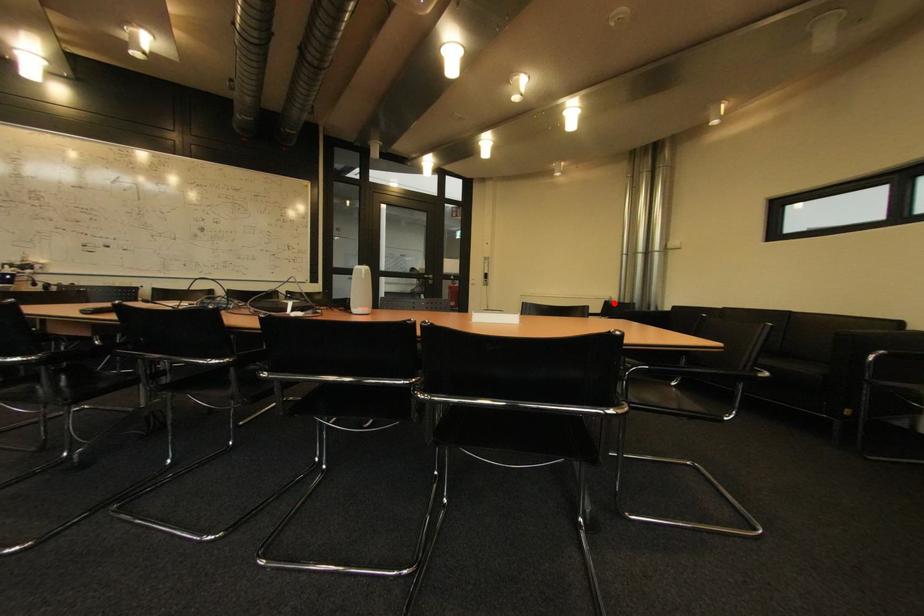
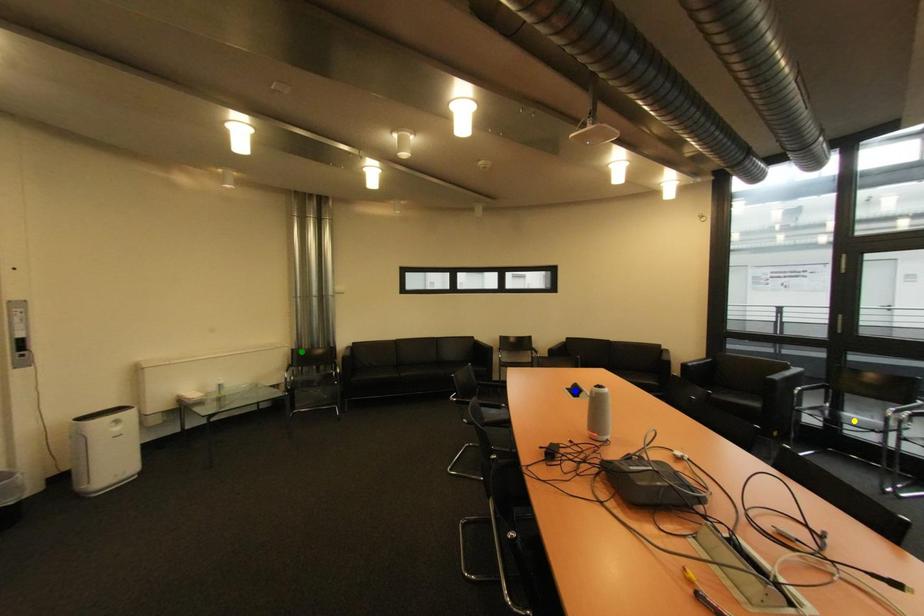
Question: I am providing you with two images of the same scene from different viewpoints. A red point is marked on the first image. You are given multiple points on the second image. Which point in image 2 represents the same 3d spot as the red point in image 1?

Choices:
 (A) green point
 (B) yellow point
 (C) blue point

Answer: (A)